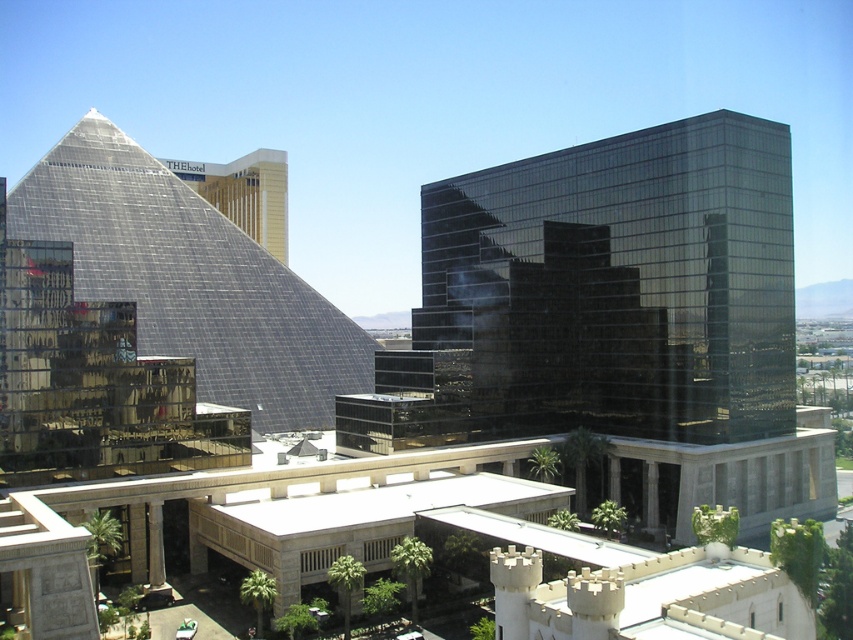
Question: Which object is closer to the camera taking this photo?

Choices:
 (A) transparent glass pyramid at left
 (B) shiny glass building at center

Answer: (A)

Question: Can you confirm if shiny glass building at center is wider than gold reflective hotel at upper left?

Choices:
 (A) no
 (B) yes

Answer: (A)

Question: Observing the image, what is the correct spatial positioning of transparent glass pyramid at left in reference to gold reflective hotel at upper left?

Choices:
 (A) left
 (B) right

Answer: (B)

Question: Which object is the farthest from the gold reflective hotel at upper left?

Choices:
 (A) transparent glass pyramid at left
 (B) shiny glass building at center

Answer: (B)

Question: Does shiny glass building at center appear on the right side of transparent glass pyramid at left?

Choices:
 (A) yes
 (B) no

Answer: (A)

Question: Which point is farther from the camera taking this photo?

Choices:
 (A) (169, 205)
 (B) (207, 173)
 (C) (618, 278)

Answer: (B)